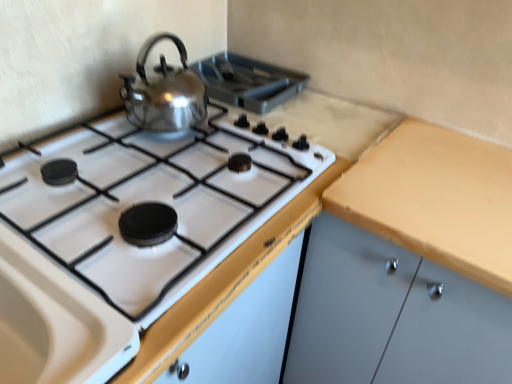
Question: Considering the relative sizes of shiny metallic kettle at upper left and matte wood cabinet at right in the image provided, is shiny metallic kettle at upper left wider than matte wood cabinet at right?

Choices:
 (A) no
 (B) yes

Answer: (A)

Question: Is shiny metallic kettle at upper left further to camera compared to matte wood cabinet at right?

Choices:
 (A) yes
 (B) no

Answer: (A)

Question: Are shiny metallic kettle at upper left and matte wood cabinet at right far apart?

Choices:
 (A) yes
 (B) no

Answer: (B)

Question: From the image's perspective, is shiny metallic kettle at upper left located above matte wood cabinet at right?

Choices:
 (A) no
 (B) yes

Answer: (B)

Question: Does shiny metallic kettle at upper left contain matte wood cabinet at right?

Choices:
 (A) yes
 (B) no

Answer: (B)

Question: From the image's perspective, is shiny metallic kettle at upper left above or below polished stainless steel kettle at upper center?

Choices:
 (A) above
 (B) below

Answer: (B)

Question: Based on their positions, is shiny metallic kettle at upper left located to the left or right of polished stainless steel kettle at upper center?

Choices:
 (A) right
 (B) left

Answer: (B)

Question: Is shiny metallic kettle at upper left inside or outside of polished stainless steel kettle at upper center?

Choices:
 (A) outside
 (B) inside

Answer: (A)

Question: Looking at the image, does shiny metallic kettle at upper left seem bigger or smaller compared to polished stainless steel kettle at upper center?

Choices:
 (A) small
 (B) big

Answer: (B)

Question: From the image's perspective, is polished stainless steel kettle at upper center positioned above or below matte wood cabinet at right?

Choices:
 (A) above
 (B) below

Answer: (A)

Question: Looking at the image, does polished stainless steel kettle at upper center seem bigger or smaller compared to matte wood cabinet at right?

Choices:
 (A) big
 (B) small

Answer: (B)

Question: Considering their positions, is polished stainless steel kettle at upper center located in front of or behind matte wood cabinet at right?

Choices:
 (A) behind
 (B) front

Answer: (A)

Question: From a real-world perspective, relative to matte wood cabinet at right, is polished stainless steel kettle at upper center vertically above or below?

Choices:
 (A) below
 (B) above

Answer: (B)

Question: From a real-world perspective, is polished stainless steel kettle at upper center above or below shiny metallic kettle at upper left?

Choices:
 (A) below
 (B) above

Answer: (A)

Question: Considering the positions of point (222, 96) and point (151, 100), is point (222, 96) closer or farther from the camera than point (151, 100)?

Choices:
 (A) farther
 (B) closer

Answer: (A)